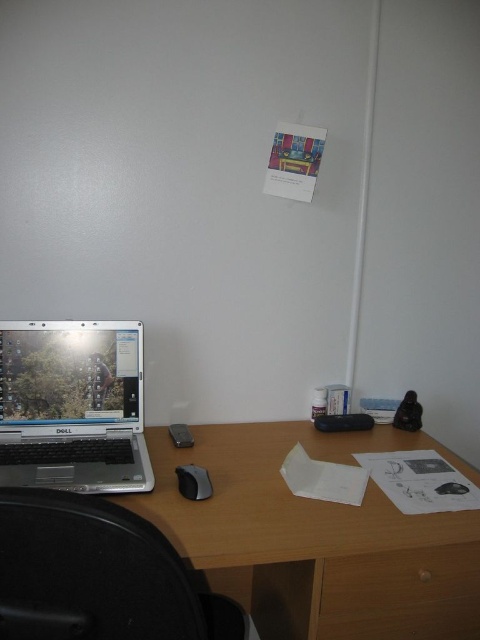
Consider the image. Does silver metallic laptop at lower left have a lesser width compared to black matte mouse at lower center?

No.

Is silver metallic laptop at lower left shorter than black matte mouse at lower center?

In fact, silver metallic laptop at lower left may be taller than black matte mouse at lower center.

Find the location of `silver metallic laptop at lower left`. silver metallic laptop at lower left is located at coordinates (72, 404).

Does wooden at center have a lesser width compared to black plastic swivel chair at lower left?

In fact, wooden at center might be wider than black plastic swivel chair at lower left.

At what (x,y) coordinates should I click in order to perform the action: click on wooden at center. Please return your answer as a coordinate pair (x, y). Looking at the image, I should click on (316, 538).

Which is above, wooden at center or silver metallic laptop at lower left?

silver metallic laptop at lower left

Does wooden at center lie behind silver metallic laptop at lower left?

No, wooden at center is in front of silver metallic laptop at lower left.

This screenshot has width=480, height=640. Identify the location of wooden at center. (316, 538).